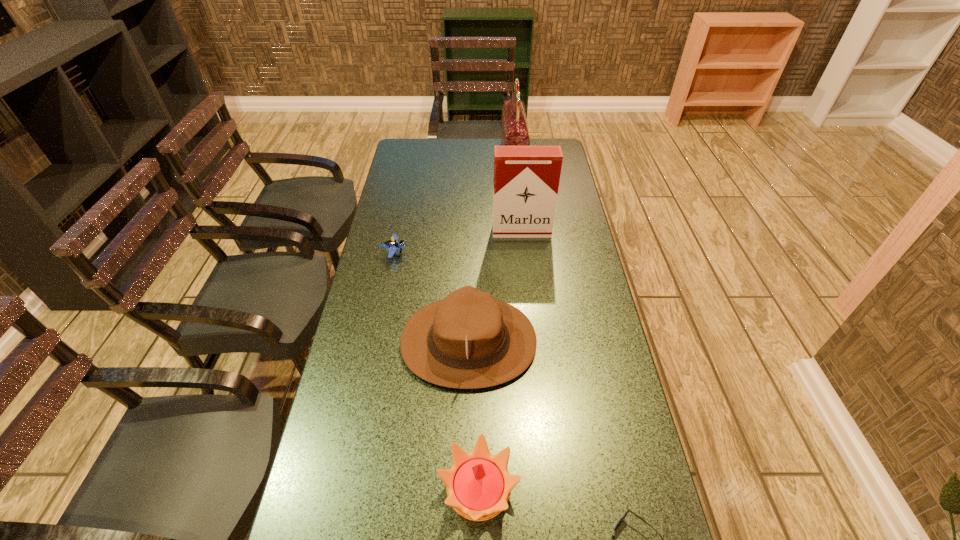
Locate an element on the screen. Image resolution: width=960 pixels, height=540 pixels. the farthest object is located at coordinates (514, 131).

What are the coordinates of `cigarette_case` in the screenshot? It's located at (526, 178).

Where is `the third tallest object`? The height and width of the screenshot is (540, 960). the third tallest object is located at coordinates (469, 340).

Identify the location of fedora. (469, 340).

You are a GUI agent. You are given a task and a screenshot of the screen. Output one action in this format:
    pyautogui.click(x=<x>, y=<y>)
    Task: Click on the third shortest object
    
    Given the screenshot: What is the action you would take?
    pyautogui.click(x=478, y=485)

At what (x,y) coordinates should I click in order to perform the action: click on the second shortest object. Please return your answer as a coordinate pair (x, y). Image resolution: width=960 pixels, height=540 pixels. Looking at the image, I should click on (392, 245).

Where is `the leftmost object`? This screenshot has height=540, width=960. the leftmost object is located at coordinates (392, 245).

The image size is (960, 540). What are the coordinates of `free region located 0.210m on the front-facing side of the farthest object` in the screenshot? It's located at [x=455, y=160].

I want to click on free space located on the front-facing side of the farthest object, so click(x=422, y=160).

At what (x,y) coordinates should I click in order to perform the action: click on vacant space located 0.400m on the front-facing side of the farthest object. Please return your answer as a coordinate pair (x, y). This screenshot has width=960, height=540. Looking at the image, I should click on (413, 160).